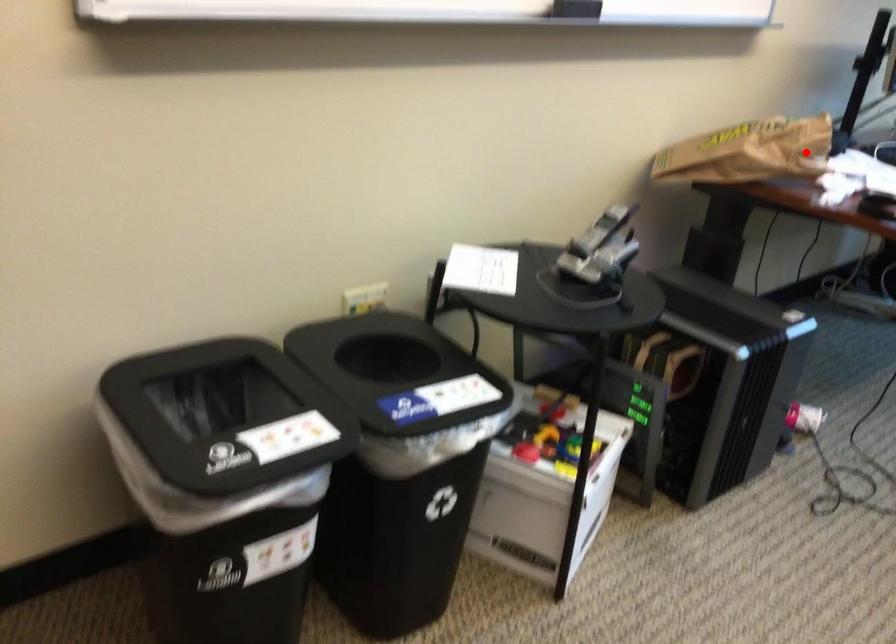
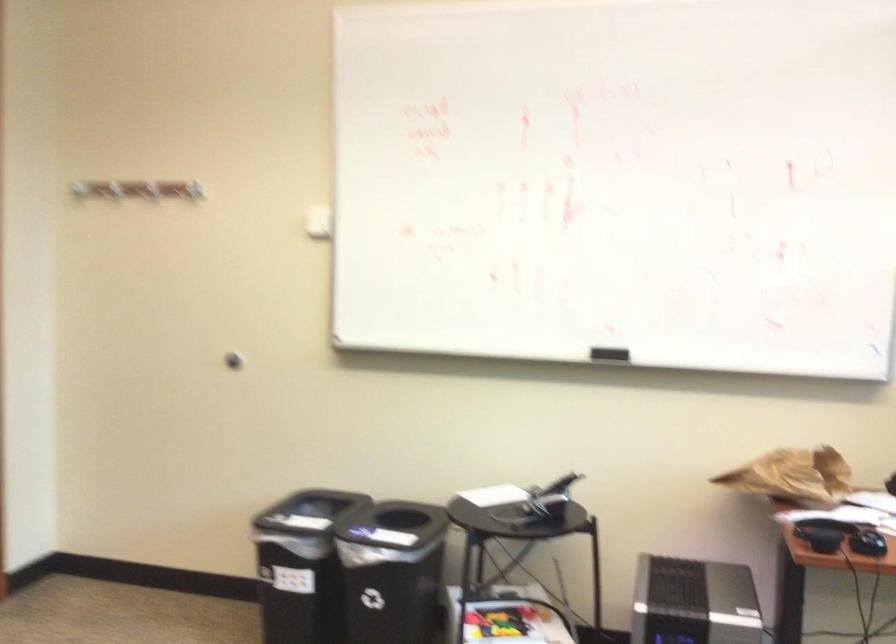
Find the pixel in the second image that matches the highlighted location in the first image.

(794, 476)